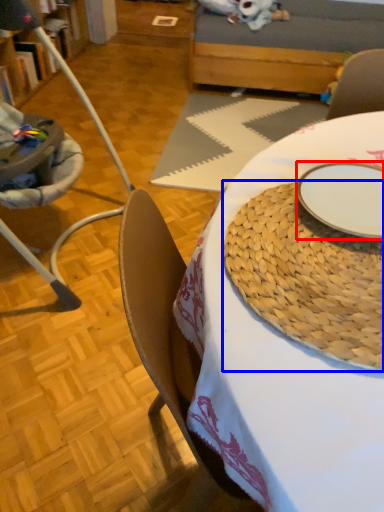
Question: Which of the following is the farthest to the observer, plate (highlighted by a red box) or platter (highlighted by a blue box)?

Choices:
 (A) plate
 (B) platter

Answer: (A)